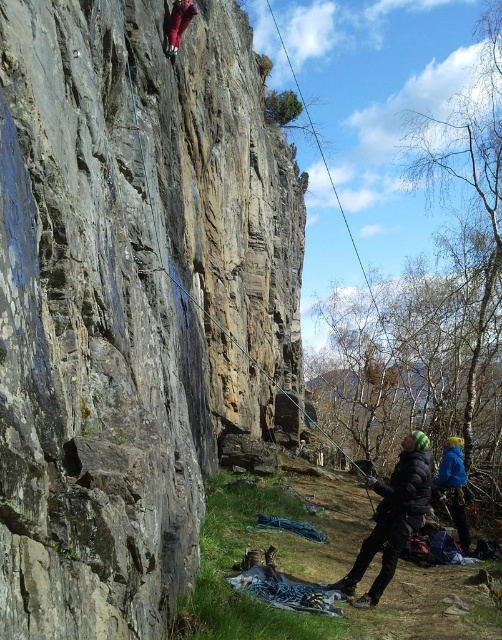
Does rough gray rock at center have a smaller size compared to shiny red leggings at upper left?

No.

Describe the element at coordinates (130, 301) in the screenshot. Image resolution: width=502 pixels, height=640 pixels. I see `rough gray rock at center` at that location.

Is point (254, 72) more distant than point (169, 49)?

Yes.

Find the location of `rough gray rock at center`. rough gray rock at center is located at coordinates (130, 301).

Which is more to the right, rough gray rock at center or blue fleece jacket at lower right?

blue fleece jacket at lower right is more to the right.

Is rough gray rock at center thinner than blue fleece jacket at lower right?

No, rough gray rock at center is not thinner than blue fleece jacket at lower right.

Find the location of a particular element. rough gray rock at center is located at coordinates (130, 301).

You are a GUI agent. You are given a task and a screenshot of the screen. Output one action in this format:
    pyautogui.click(x=<x>, y=<y>)
    Task: Click on the rough gray rock at center
    
    Given the screenshot: What is the action you would take?
    pyautogui.click(x=130, y=301)

From the picture: Which is more to the left, black puffy jacket at lower center or shiny red leggings at upper left?

From the viewer's perspective, shiny red leggings at upper left appears more on the left side.

Does black puffy jacket at lower center have a smaller size compared to shiny red leggings at upper left?

No, black puffy jacket at lower center is not smaller than shiny red leggings at upper left.

The width and height of the screenshot is (502, 640). Describe the element at coordinates (393, 516) in the screenshot. I see `black puffy jacket at lower center` at that location.

Locate an element on the screen. This screenshot has height=640, width=502. black puffy jacket at lower center is located at coordinates (393, 516).